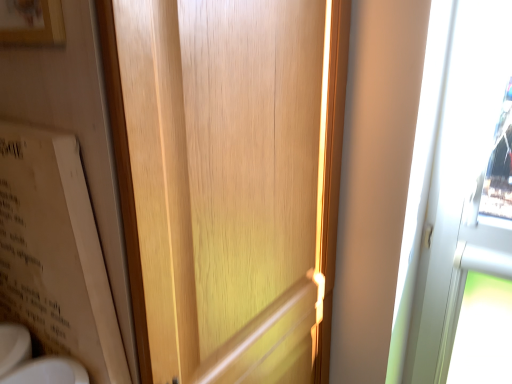
Question: Are wooden picture frame at upper left and white glossy sink at lower left located far from each other?

Choices:
 (A) no
 (B) yes

Answer: (A)

Question: Is wooden picture frame at upper left taller than white glossy sink at lower left?

Choices:
 (A) no
 (B) yes

Answer: (B)

Question: Is wooden picture frame at upper left behind white glossy sink at lower left?

Choices:
 (A) yes
 (B) no

Answer: (B)

Question: From a real-world perspective, does wooden picture frame at upper left stand above white glossy sink at lower left?

Choices:
 (A) no
 (B) yes

Answer: (B)

Question: From a real-world perspective, is wooden picture frame at upper left under white glossy sink at lower left?

Choices:
 (A) no
 (B) yes

Answer: (A)

Question: From the image's perspective, is wooden picture frame at upper left located above white glossy sink at lower left?

Choices:
 (A) no
 (B) yes

Answer: (B)

Question: Considering the relative positions of white glossy sink at lower left and wooden picture frame at upper left in the image provided, is white glossy sink at lower left to the right of wooden picture frame at upper left from the viewer's perspective?

Choices:
 (A) no
 (B) yes

Answer: (A)

Question: Is white glossy sink at lower left behind wooden picture frame at upper left?

Choices:
 (A) yes
 (B) no

Answer: (A)

Question: From a real-world perspective, is white glossy sink at lower left under wooden picture frame at upper left?

Choices:
 (A) no
 (B) yes

Answer: (B)

Question: Is there a large distance between white glossy sink at lower left and wooden picture frame at upper left?

Choices:
 (A) yes
 (B) no

Answer: (B)

Question: Is white glossy sink at lower left to the left of wooden picture frame at upper left from the viewer's perspective?

Choices:
 (A) no
 (B) yes

Answer: (B)

Question: Is white glossy sink at lower left smaller than wooden picture frame at upper left?

Choices:
 (A) no
 (B) yes

Answer: (A)

Question: Is wooden picture frame at upper left far from wooden door at center?

Choices:
 (A) yes
 (B) no

Answer: (B)